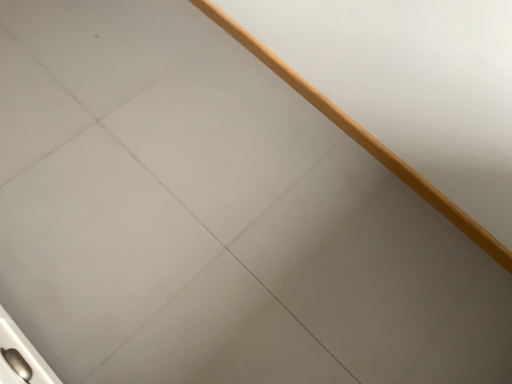
Describe the element at coordinates (362, 137) in the screenshot. This screenshot has height=384, width=512. I see `wooden beam at upper right` at that location.

This screenshot has height=384, width=512. I want to click on wooden beam at upper right, so click(x=362, y=137).

I want to click on wooden beam at upper right, so click(x=362, y=137).